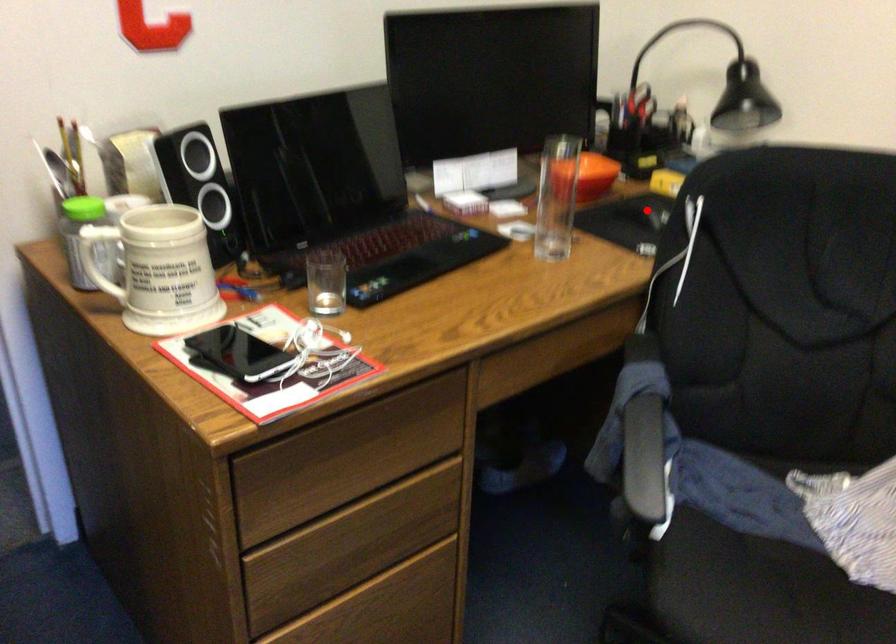
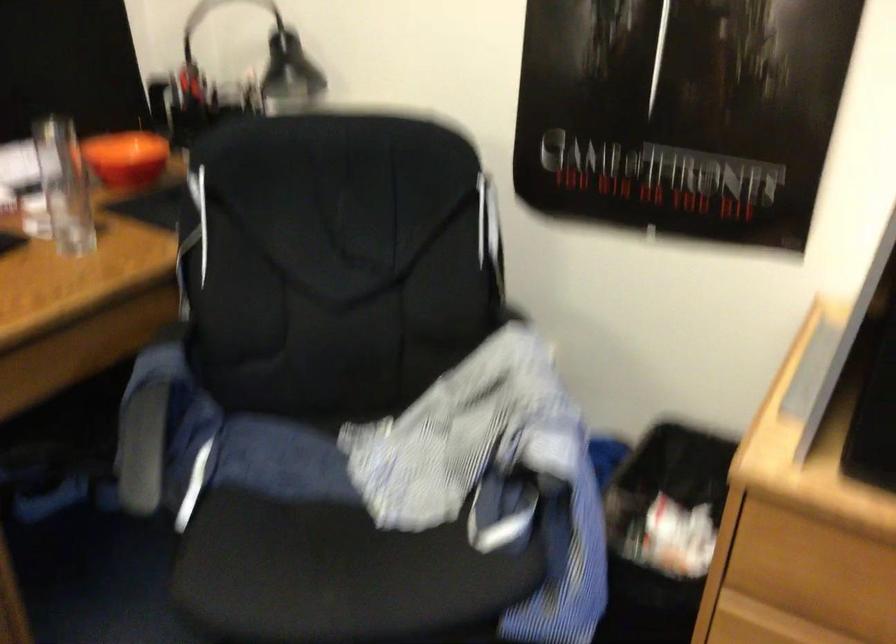
Question: I am providing you with two images of the same scene from different viewpoints. A red point is marked on the first image. Can you still see the location of the red point in image 2?

Choices:
 (A) Yes
 (B) No

Answer: (B)